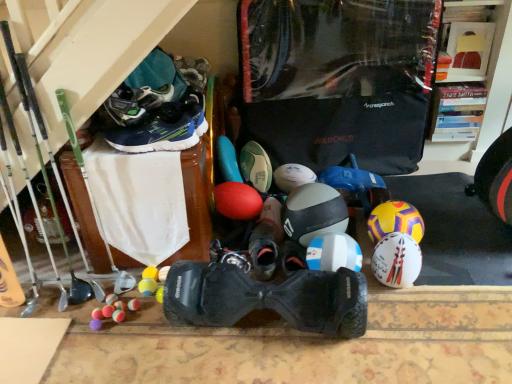
Locate an element on the screen. free location in front of white matte helmet at center, the 2th helmet when ordered from right to left is located at coordinates (411, 314).